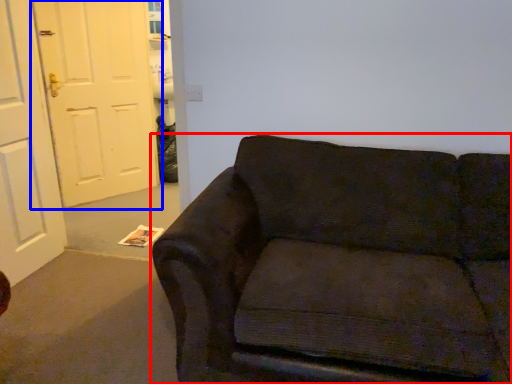
Question: Which object appears closest to the camera in this image, studio couch (highlighted by a red box) or door (highlighted by a blue box)?

Choices:
 (A) studio couch
 (B) door

Answer: (A)